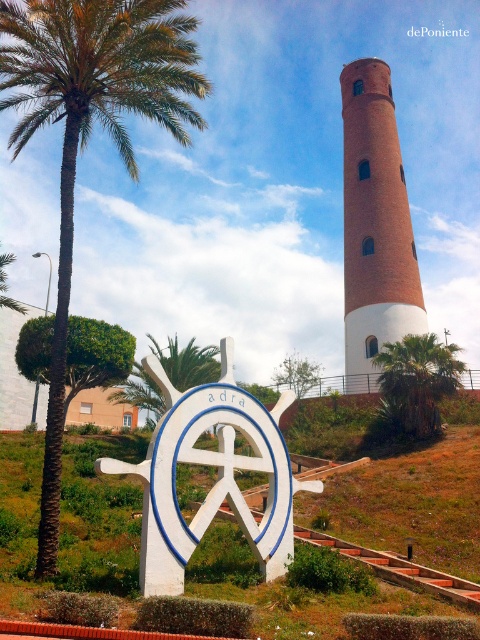
Question: Which point is closer to the camera?

Choices:
 (A) brick tower at center
 (B) white matte sign at center

Answer: (B)

Question: From the image, what is the correct spatial relationship of green leafy palm tree at left in relation to white matte sign at center?

Choices:
 (A) above
 (B) below

Answer: (A)

Question: Which point is farther to the camera?

Choices:
 (A) (379, 337)
 (B) (52, 93)
 (C) (162, 372)

Answer: (A)

Question: Which of the following is the farthest from the observer?

Choices:
 (A) (394, 326)
 (B) (8, 17)

Answer: (A)

Question: In this image, where is white matte sign at center located relative to brick tower at center?

Choices:
 (A) right
 (B) left

Answer: (B)

Question: Where is green leafy palm tree at left located in relation to white matte sign at center in the image?

Choices:
 (A) above
 (B) below

Answer: (A)